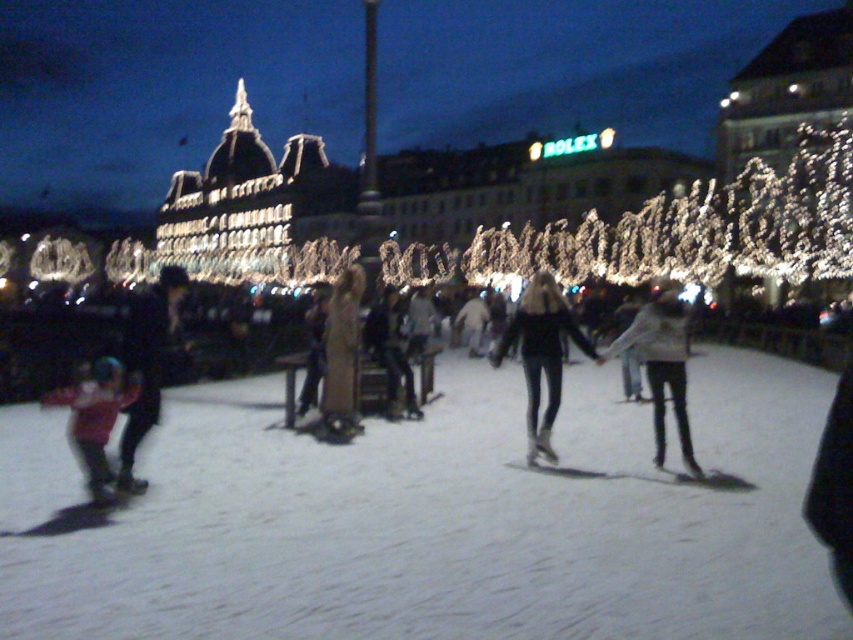
Does point (496, 513) come behind point (358, 291)?

No, (496, 513) is in front of (358, 291).

Does white smooth ice at center appear under brown leather jacket at center?

Indeed, white smooth ice at center is positioned under brown leather jacket at center.

Is point (387, 525) farther from viewer compared to point (331, 394)?

No, (387, 525) is closer to viewer.

Identify the location of white smooth ice at center. (433, 518).

In the scene shown: Can you confirm if white smooth ice at center is positioned below black matte jacket at center?

Yes.

Between point (370, 552) and point (535, 336), which one is positioned behind?

Point (535, 336)

Is point (489, 499) more distant than point (524, 326)?

No, it is not.

You are a GUI agent. You are given a task and a screenshot of the screen. Output one action in this format:
    pyautogui.click(x=<x>, y=<y>)
    Task: Click on the white smooth ice at center
    
    Given the screenshot: What is the action you would take?
    coord(433,518)

Is matte pink jacket at lower left thinner than brown leather jacket at center?

No, matte pink jacket at lower left is not thinner than brown leather jacket at center.

This screenshot has width=853, height=640. Find the location of `matte pink jacket at lower left`. matte pink jacket at lower left is located at coordinates (96, 420).

Identify the location of matte pink jacket at lower left. The width and height of the screenshot is (853, 640). (96, 420).